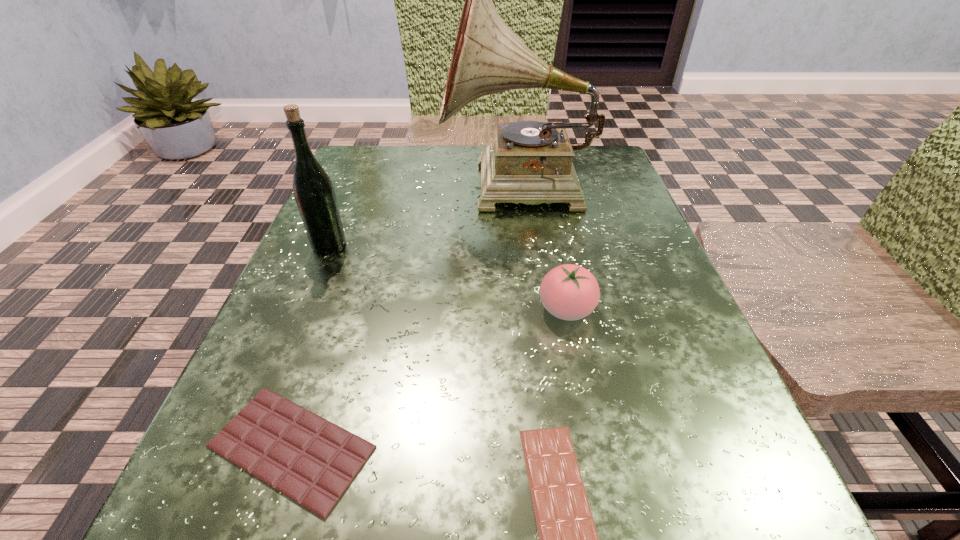
I want to click on the farthest object, so click(x=530, y=162).

You are a GUI agent. You are given a task and a screenshot of the screen. Output one action in this format:
    pyautogui.click(x=<x>, y=<y>)
    Task: Click on the record player
    
    Given the screenshot: What is the action you would take?
    pyautogui.click(x=530, y=162)

You are a GUI agent. You are given a task and a screenshot of the screen. Output one action in this format:
    pyautogui.click(x=<x>, y=<y>)
    Task: Click on the second tallest object
    The height and width of the screenshot is (540, 960).
    Given the screenshot: What is the action you would take?
    pyautogui.click(x=314, y=193)

You are a GUI agent. You are given a task and a screenshot of the screen. Output one action in this format:
    pyautogui.click(x=<x>, y=<y>)
    Task: Click on the second farthest object
    
    Given the screenshot: What is the action you would take?
    pyautogui.click(x=314, y=193)

Where is `tomato`? tomato is located at coordinates (570, 292).

You are a GUI agent. You are given a task and a screenshot of the screen. Output one action in this format:
    pyautogui.click(x=<x>, y=<y>)
    Task: Click on the third farthest object
    This screenshot has width=960, height=540.
    Given the screenshot: What is the action you would take?
    pyautogui.click(x=570, y=292)

Locate an element on the screen. This screenshot has width=960, height=540. the fourth tallest object is located at coordinates tap(312, 461).

Identify the location of the taller chocolate bar. click(312, 461).

Where is `vacant region located 0.050m from the horn of the record player`? This screenshot has width=960, height=540. vacant region located 0.050m from the horn of the record player is located at coordinates pyautogui.click(x=420, y=188).

Identify the location of free location located 0.100m from the horn of the record player. Image resolution: width=960 pixels, height=540 pixels. (396, 188).